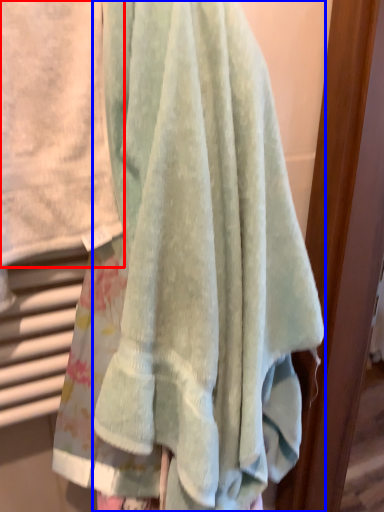
Question: Which object appears farthest to the camera in this image, towel (highlighted by a red box) or towel (highlighted by a blue box)?

Choices:
 (A) towel
 (B) towel

Answer: (B)